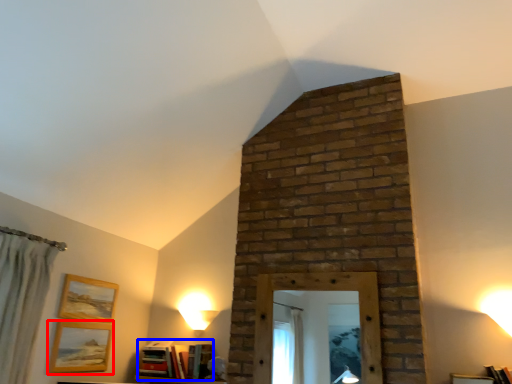
Question: Which object is closer to the camera taking this photo, picture frame (highlighted by a red box) or book (highlighted by a blue box)?

Choices:
 (A) picture frame
 (B) book

Answer: (A)